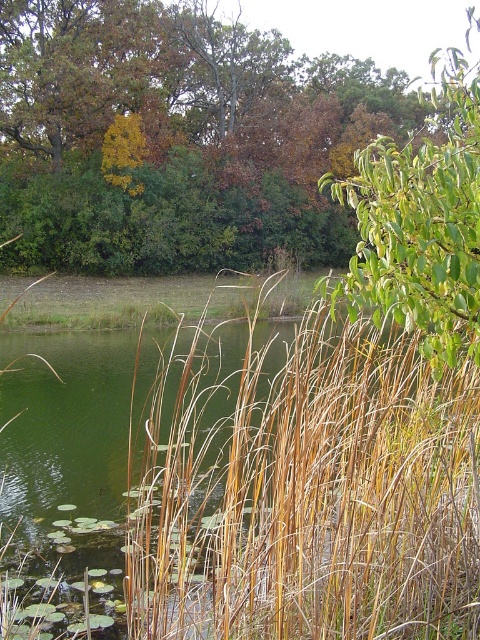
Who is shorter, brown leafy tree at upper center or green leafy tree at upper right?

brown leafy tree at upper center

Is brown leafy tree at upper center positioned before green leafy tree at upper right?

No, it is not.

The width and height of the screenshot is (480, 640). What are the coordinates of `brown leafy tree at upper center` in the screenshot? It's located at (177, 138).

Who is positioned more to the left, brown dry grass at center or green leafy tree at upper right?

brown dry grass at center is more to the left.

Is point (439, 577) farther from viewer compared to point (370, 305)?

Yes, point (439, 577) is behind point (370, 305).

Find the location of a particular element. The height and width of the screenshot is (640, 480). brown dry grass at center is located at coordinates (311, 496).

Does brown dry grass at center appear over brown leafy tree at upper center?

Incorrect, brown dry grass at center is not positioned above brown leafy tree at upper center.

Looking at this image, can you confirm if brown dry grass at center is positioned to the left of brown leafy tree at upper center?

Correct, you'll find brown dry grass at center to the left of brown leafy tree at upper center.

Is point (218, 561) closer to viewer compared to point (51, 49)?

That is True.

You are a GUI agent. You are given a task and a screenshot of the screen. Output one action in this format:
    pyautogui.click(x=<x>, y=<y>)
    Task: Click on the brown dry grass at center
    This screenshot has width=480, height=640.
    Given the screenshot: What is the action you would take?
    pyautogui.click(x=311, y=496)